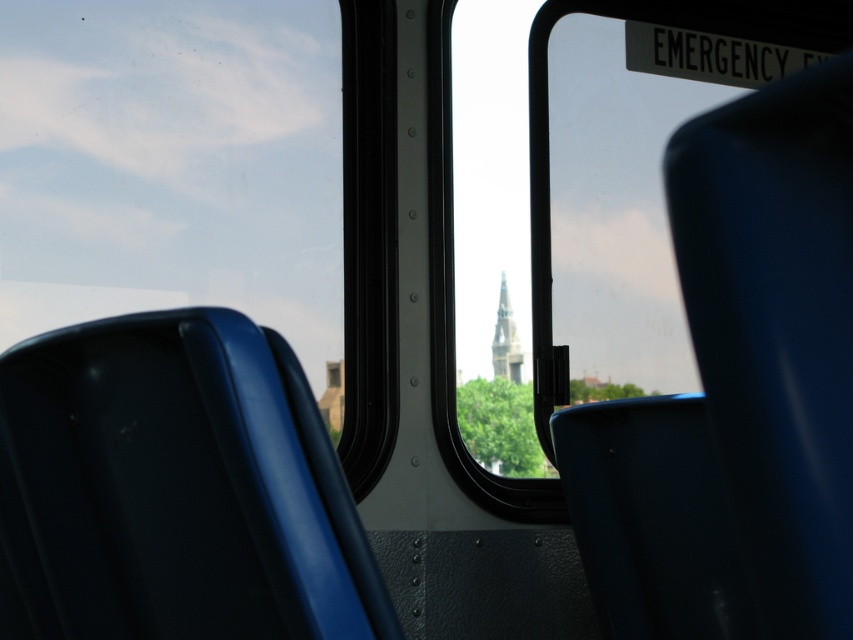
Is matte blue chair at center behind smooth gray stone tower at center?

That is False.

Is point (56, 342) positioned before point (514, 358)?

That is True.

Does point (212, 442) lie behind point (502, 358)?

No, it is in front of (502, 358).

The width and height of the screenshot is (853, 640). I want to click on matte blue chair at center, so click(x=175, y=488).